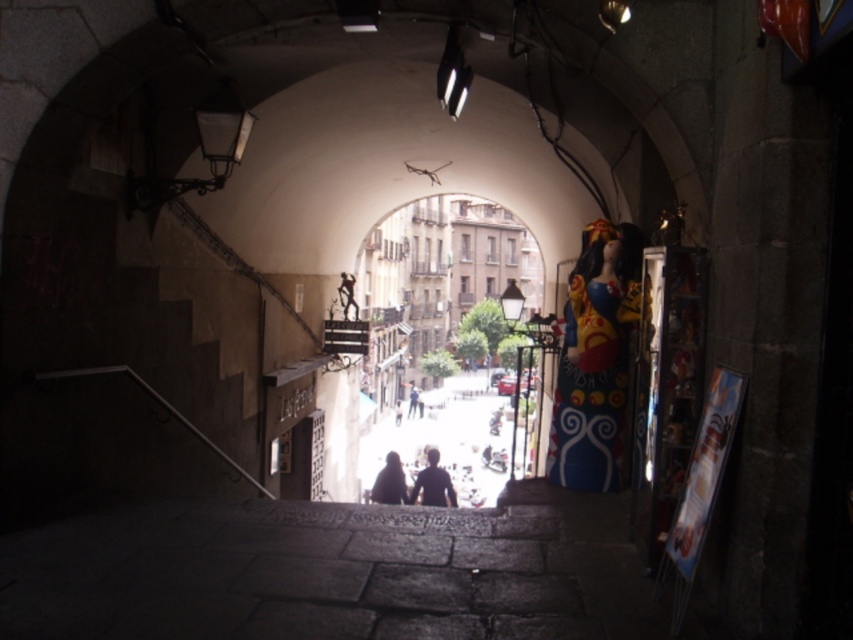
The image size is (853, 640). What do you see at coordinates (433, 483) in the screenshot?
I see `dark blue shirt at center` at bounding box center [433, 483].

In the scene shown: Does dark blue shirt at center come in front of dark matte figure at center?

No, dark blue shirt at center is further to the viewer.

Which is behind, point (421, 492) or point (392, 492)?

The point (421, 492) is more distant.

Locate an element on the screen. This screenshot has width=853, height=640. dark blue shirt at center is located at coordinates (433, 483).

Which is below, matte black figures at center or dark blue fabric at center?

dark blue fabric at center is below.

Does matte black figures at center lie behind dark blue fabric at center?

No, it is not.

Image resolution: width=853 pixels, height=640 pixels. I want to click on matte black figures at center, so click(445, 440).

Does matte black figures at center appear over dark blue shirt at center?

Actually, matte black figures at center is below dark blue shirt at center.

Does point (492, 458) come in front of point (413, 499)?

That is False.

I want to click on matte black figures at center, so click(x=445, y=440).